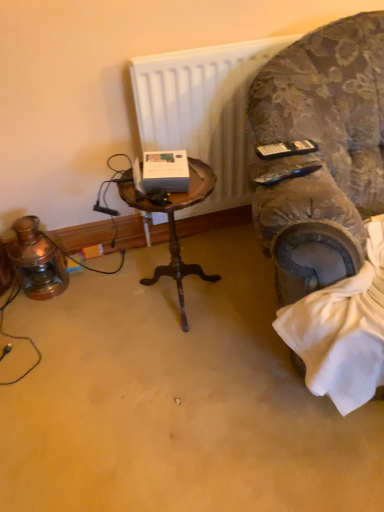
At what (x,y) coordinates should I click in order to perform the action: click on vacant space to the right of woodenobject at center. Please return your answer as a coordinate pair (x, y). This screenshot has width=384, height=512. Looking at the image, I should click on (239, 287).